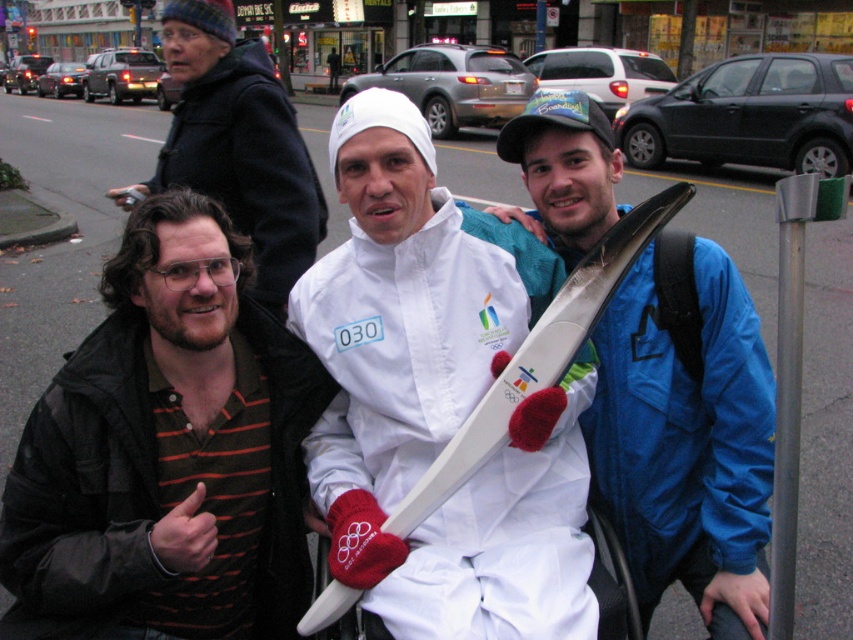
Is white matte olympic torch at center shorter than brown woolen hat at upper left?

Indeed, white matte olympic torch at center has a lesser height compared to brown woolen hat at upper left.

Which of these two, white matte olympic torch at center or brown woolen hat at upper left, stands shorter?

white matte olympic torch at center

Find the location of a particular element. white matte olympic torch at center is located at coordinates (412, 340).

Is brown striped shirt at center to the left of white matte olympic torch at center from the viewer's perspective?

Indeed, brown striped shirt at center is positioned on the left side of white matte olympic torch at center.

Who is taller, brown striped shirt at center or white matte olympic torch at center?

brown striped shirt at center

Locate an element on the screen. brown striped shirt at center is located at coordinates (166, 452).

What do you see at coordinates (166, 452) in the screenshot? This screenshot has height=640, width=853. I see `brown striped shirt at center` at bounding box center [166, 452].

Is point (177, 540) farther from viewer compared to point (654, 365)?

No, it is not.

Where is `brown striped shirt at center`? The image size is (853, 640). brown striped shirt at center is located at coordinates (166, 452).